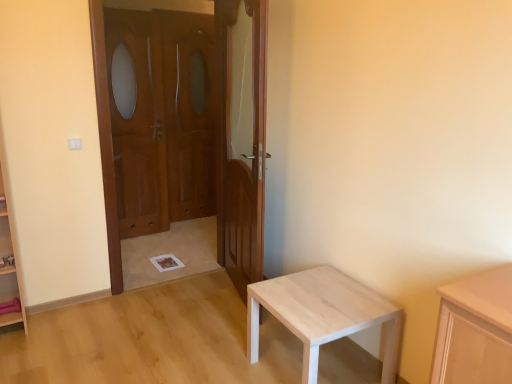
The width and height of the screenshot is (512, 384). In order to click on vacant region below wooden door at left, placed as the second door when sorted from right to left (from a real-world perspective) in this screenshot , I will do `click(178, 275)`.